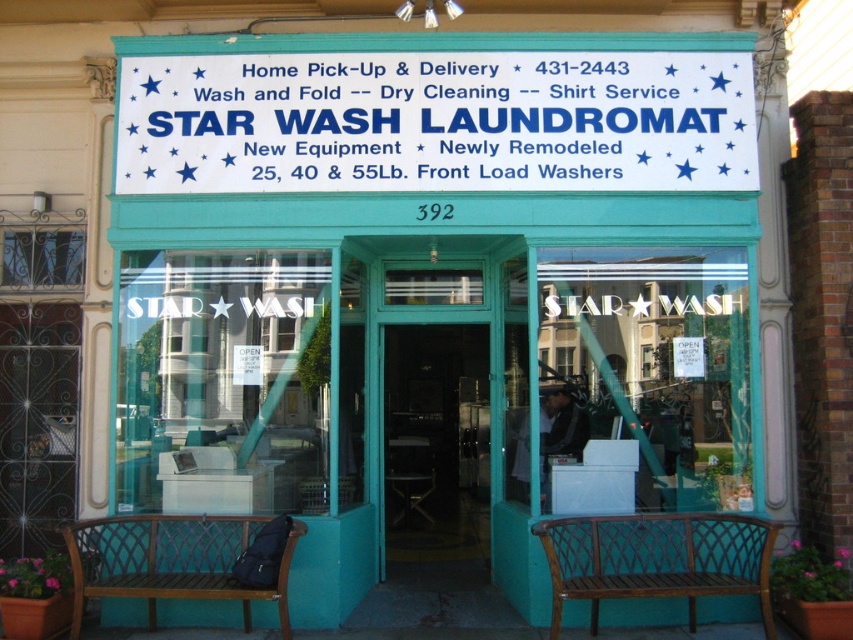
Question: Is white/blue text sign at upper center positioned behind transparent glass door at center?

Choices:
 (A) yes
 (B) no

Answer: (B)

Question: Does white/blue text sign at upper center have a larger size compared to transparent glass door at center?

Choices:
 (A) yes
 (B) no

Answer: (B)

Question: Based on their relative distances, which object is farther from the white/blue text sign at upper center?

Choices:
 (A) brown wooden bench at lower center
 (B) brown wooden bench at lower left
 (C) transparent glass door at center

Answer: (C)

Question: Does transparent glass door at center appear under brown wooden bench at lower left?

Choices:
 (A) no
 (B) yes

Answer: (A)

Question: Considering the real-world distances, which object is farthest from the white/blue text sign at upper center?

Choices:
 (A) brown wooden bench at lower center
 (B) brown wooden bench at lower left

Answer: (B)

Question: Among these objects, which one is farthest from the camera?

Choices:
 (A) brown wooden bench at lower center
 (B) white/blue text sign at upper center

Answer: (B)